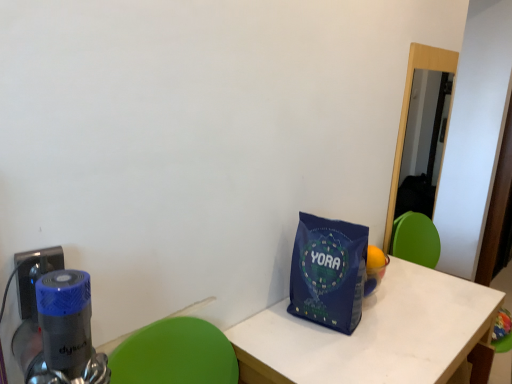
This screenshot has height=384, width=512. Identify the location of vacant region to the left of blue fabric tote bag at lower right. (269, 325).